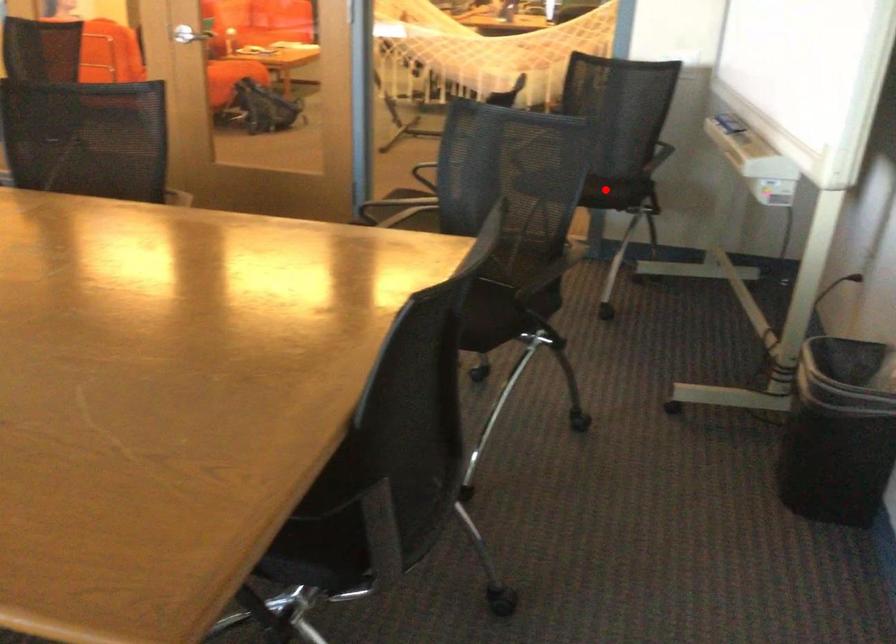
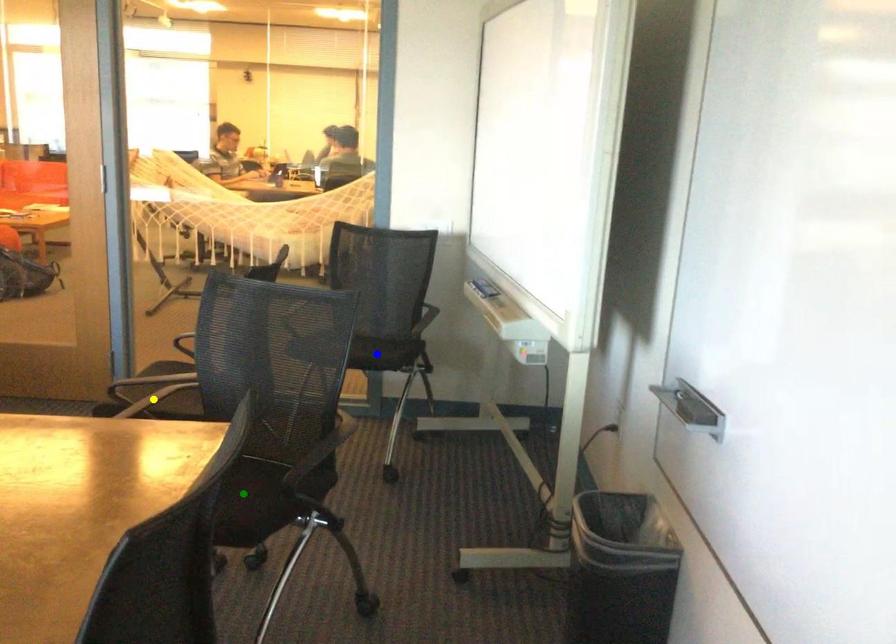
Question: I am providing you with two images of the same scene from different viewpoints. A red point is marked on the first image. You are given multiple points on the second image. Which point in image 2 is actually the same real-world point as the red point in image 1?

Choices:
 (A) blue point
 (B) yellow point
 (C) green point

Answer: (A)